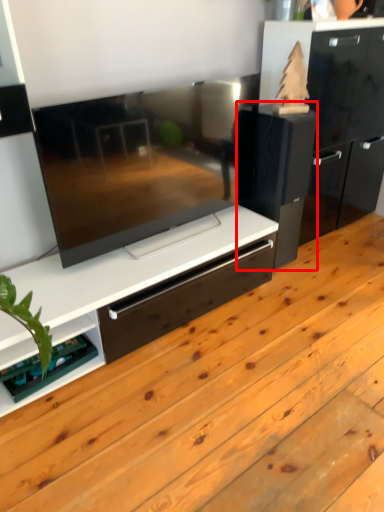
Question: From the image's perspective, what is the correct spatial positioning of appliance (annotated by the red box) in reference to shelf?

Choices:
 (A) above
 (B) below

Answer: (A)